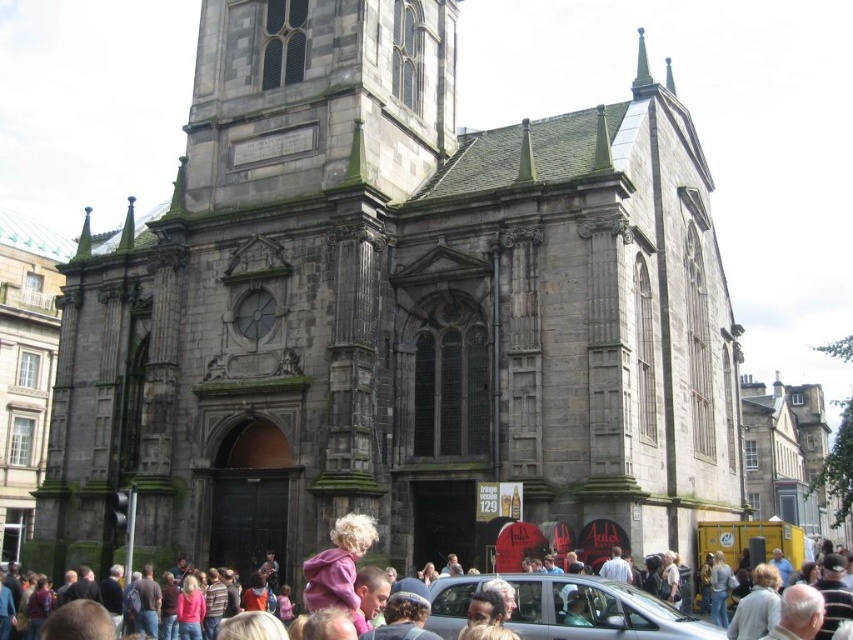
Question: Which object appears farthest from the camera in this image?

Choices:
 (A) metallic silver car at center
 (B) multicolored casual clothing at lower center

Answer: (A)

Question: Is metallic silver car at center positioned in front of multicolored casual clothing at lower center?

Choices:
 (A) yes
 (B) no

Answer: (B)

Question: Can you confirm if metallic silver car at center is bigger than purple fleece at center?

Choices:
 (A) no
 (B) yes

Answer: (A)

Question: Which object is the closest to the metallic silver car at center?

Choices:
 (A) purple fleece at center
 (B) multicolored casual clothing at lower center

Answer: (B)

Question: Among these objects, which one is nearest to the camera?

Choices:
 (A) multicolored casual clothing at lower center
 (B) purple fleece at center

Answer: (B)

Question: Does metallic silver car at center have a greater width compared to multicolored casual clothing at lower center?

Choices:
 (A) no
 (B) yes

Answer: (A)